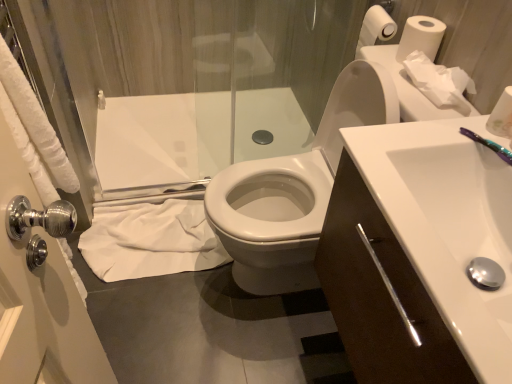
The width and height of the screenshot is (512, 384). What are the coordinates of `vacant area that is in front of white cloth at lower left` in the screenshot? It's located at (158, 318).